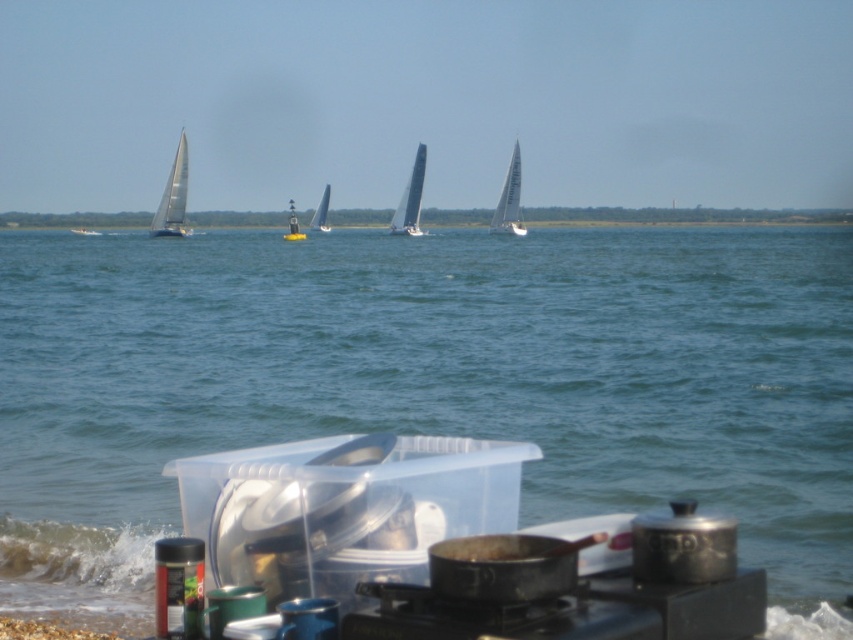
Measure the distance between yellow buoy at center and white sailboat at left.

yellow buoy at center and white sailboat at left are 57.13 feet apart.

Is point (294, 214) farther from camera compared to point (97, 230)?

No, it is not.

Which is in front, point (289, 220) or point (82, 234)?

Point (289, 220)

This screenshot has height=640, width=853. What are the coordinates of `yellow buoy at center` in the screenshot? It's located at (293, 225).

Is clear plastic container at center taller than white sailboat at right?

No, clear plastic container at center is not taller than white sailboat at right.

From the picture: Can you confirm if clear plastic container at center is positioned above white sailboat at right?

No.

Which is behind, point (413, 602) or point (506, 220)?

Point (506, 220)

Where is `clear plastic container at center`? The width and height of the screenshot is (853, 640). clear plastic container at center is located at coordinates (454, 547).

Can you confirm if clear plastic container at center is thinner than white sail at center?

Yes, clear plastic container at center is thinner than white sail at center.

Is clear plastic container at center above white sail at center?

No.

In order to click on clear plastic container at center in this screenshot , I will do `click(454, 547)`.